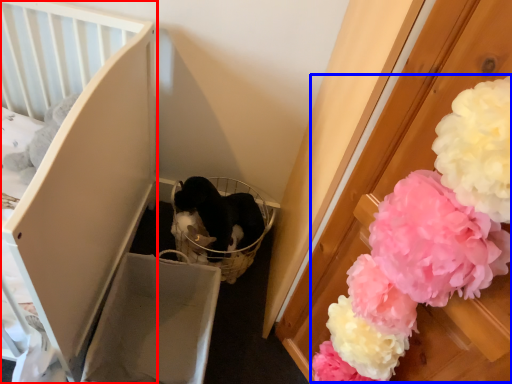
Question: Which object appears farthest to the camera in this image, furniture (highlighted by a red box) or flower (highlighted by a blue box)?

Choices:
 (A) furniture
 (B) flower

Answer: (A)